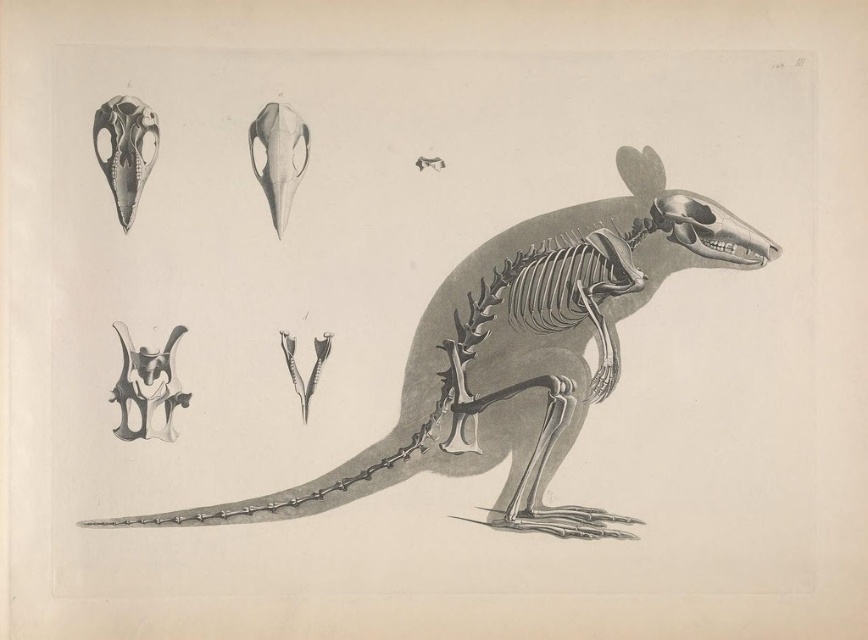
Consider the image. Can you confirm if gray bone skeleton at center is positioned to the left of smooth gray skull at upper center?

In fact, gray bone skeleton at center is to the right of smooth gray skull at upper center.

Is gray bone skeleton at center below smooth gray skull at upper center?

Indeed, gray bone skeleton at center is positioned under smooth gray skull at upper center.

Find the location of a particular element. The height and width of the screenshot is (640, 868). gray bone skeleton at center is located at coordinates (523, 353).

At what (x,y) coordinates should I click in order to perform the action: click on gray bone skeleton at center. Please return your answer as a coordinate pair (x, y). Looking at the image, I should click on 523,353.

Is matte black skull at upper left wider than smooth gray skull at upper center?

Indeed, matte black skull at upper left has a greater width compared to smooth gray skull at upper center.

The width and height of the screenshot is (868, 640). What do you see at coordinates (125, 150) in the screenshot?
I see `matte black skull at upper left` at bounding box center [125, 150].

Where is `matte black skull at upper left`? This screenshot has width=868, height=640. matte black skull at upper left is located at coordinates (125, 150).

Is smooth gray bone at lower left above smooth gray skull at upper center?

Actually, smooth gray bone at lower left is below smooth gray skull at upper center.

Is smooth gray bone at lower left closer to camera compared to smooth gray skull at upper center?

Yes, it is.

Who is more forward, (149, 397) or (287, 122)?

Point (149, 397) is in front.

This screenshot has width=868, height=640. I want to click on smooth gray bone at lower left, so click(148, 387).